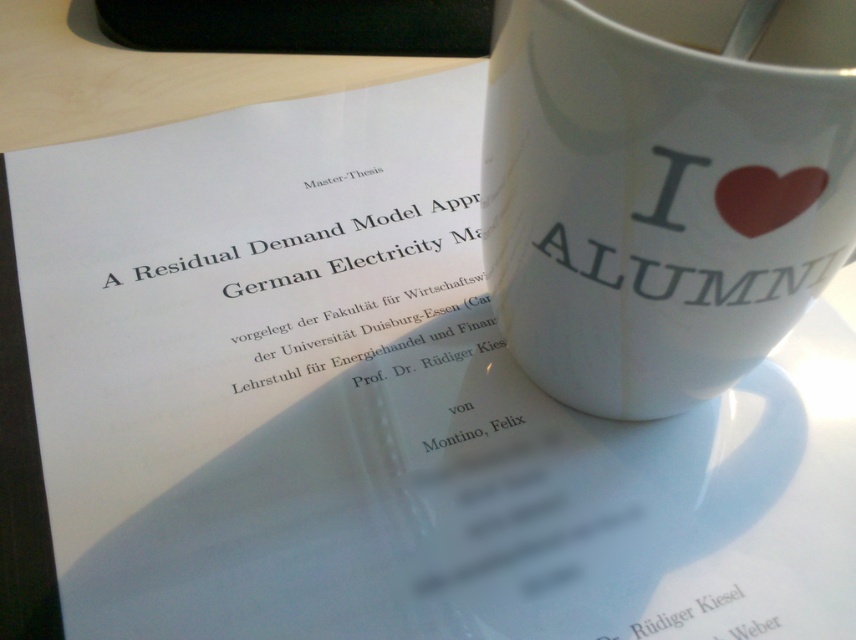
You are a student who just finished your thesis and want to place your Master thesis paper on the desk next to the white ceramic mug at upper right. Based on the coordinates provided, can you determine if there is enough space to place the paper without overlapping the mug?

The white ceramic mug at upper right is located at point (663, 188). Since the paper is to be placed to the left of the mug, there should be sufficient space as the mug is positioned at the upper right, allowing the paper to be placed to its left without overlapping.

You are organizing a study session and need to place a laptop between the white ceramic mug at upper right and the white glossy mug at upper center. The laptop requires 15 inches of space. Is there enough space between them to fit the laptop?

The distance between the white ceramic mug at upper right and the white glossy mug at upper center is 14.14 inches, which is less than the required 15 inches. Therefore, there is not enough space to fit the laptop between them.